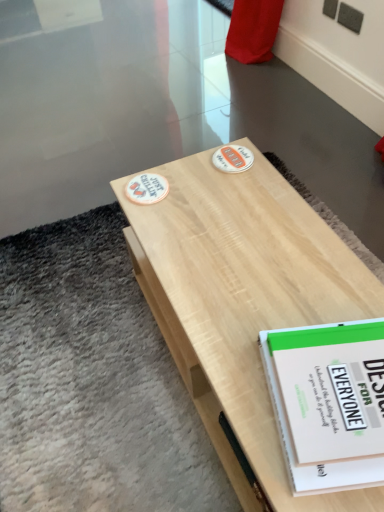
Find the location of a particular element. This screenshot has width=384, height=512. free space above light wood table at center (from a real-world perspective) is located at coordinates (252, 253).